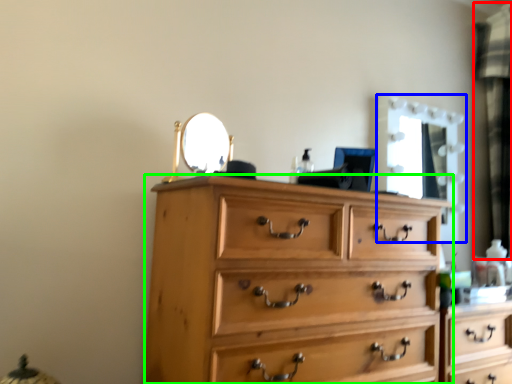
Question: Which is farther away from curtain (highlighted by a red box)? mirror (highlighted by a blue box) or chest of drawers (highlighted by a green box)?

Choices:
 (A) mirror
 (B) chest of drawers

Answer: (B)